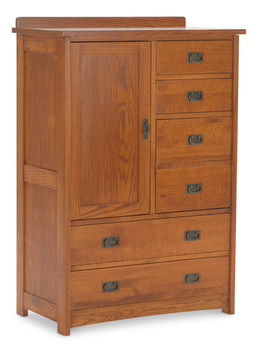
What are the coordinates of `lower compartment` in the screenshot? It's located at (138, 276), (143, 245).